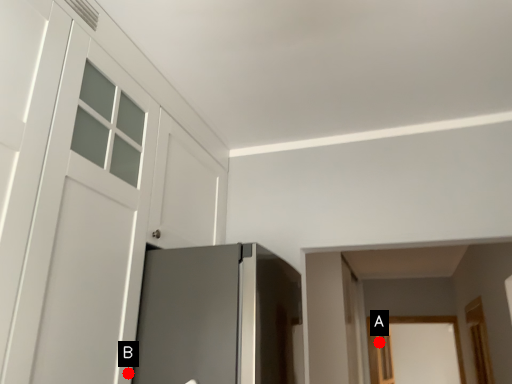
Question: Two points are circled on the image, labeled by A and B beside each circle. Which of the following is the closest to the observer?

Choices:
 (A) A is closer
 (B) B is closer

Answer: (B)